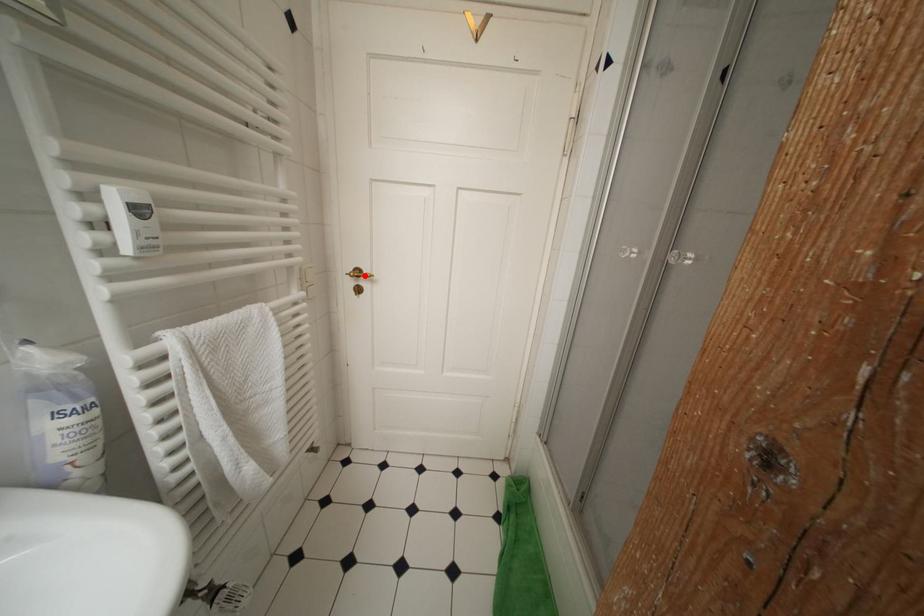
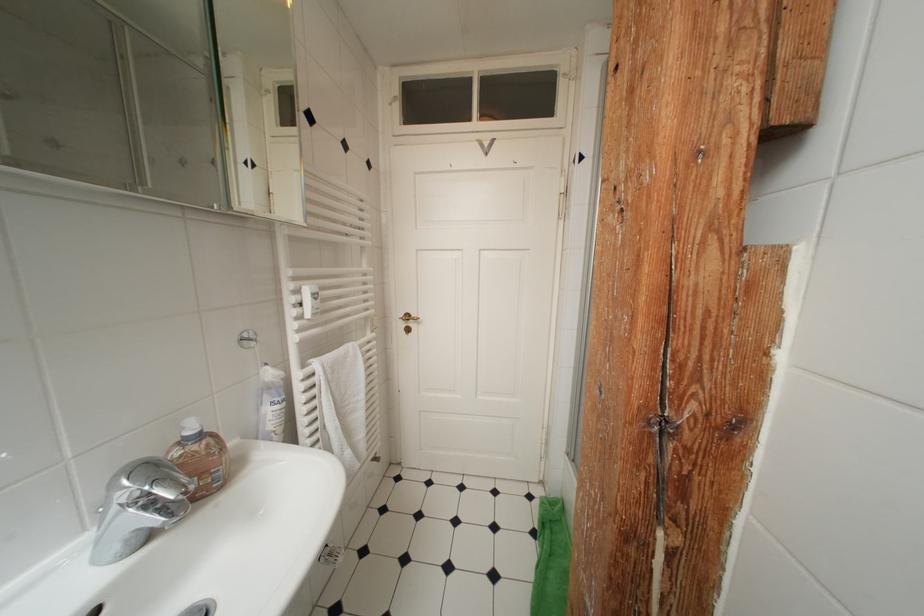
Find the pixel in the second image that matches the highlighted location in the first image.

(415, 320)